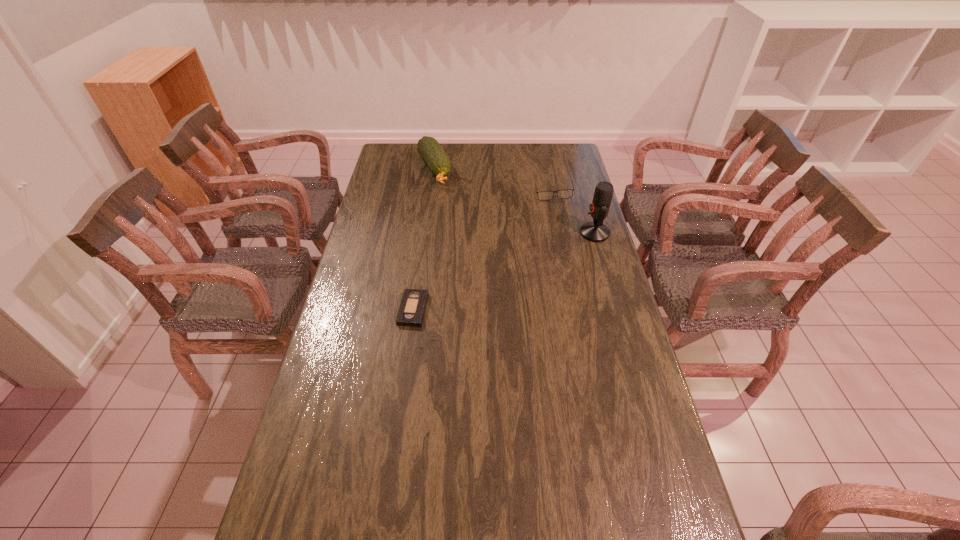
Identify the location of blank space at the near edge. (575, 507).

In the image, there is a desktop. Identify the location of vacant space at the left edge. The width and height of the screenshot is (960, 540). (299, 480).

Find the location of `free space at the right edge of the desktop`. free space at the right edge of the desktop is located at coordinates (548, 181).

This screenshot has width=960, height=540. Identify the location of free region at the far left corner. (387, 151).

This screenshot has height=540, width=960. Find the location of `free space at the far right corner of the desktop`. free space at the far right corner of the desktop is located at coordinates (567, 150).

The image size is (960, 540). In order to click on vacant region between the second shortest object and the tallest object in this screenshot , I will do `click(574, 213)`.

The width and height of the screenshot is (960, 540). What are the coordinates of `free space between the shortest object and the microphone` in the screenshot? It's located at point(504,271).

Identify the location of free space between the tallest object and the cucumber. (515, 201).

Where is `free area in between the microphone and the second shortest object`? This screenshot has width=960, height=540. free area in between the microphone and the second shortest object is located at coordinates (574, 213).

The image size is (960, 540). What are the coordinates of `free spot between the third tallest object and the third shortest object` in the screenshot? It's located at (493, 182).